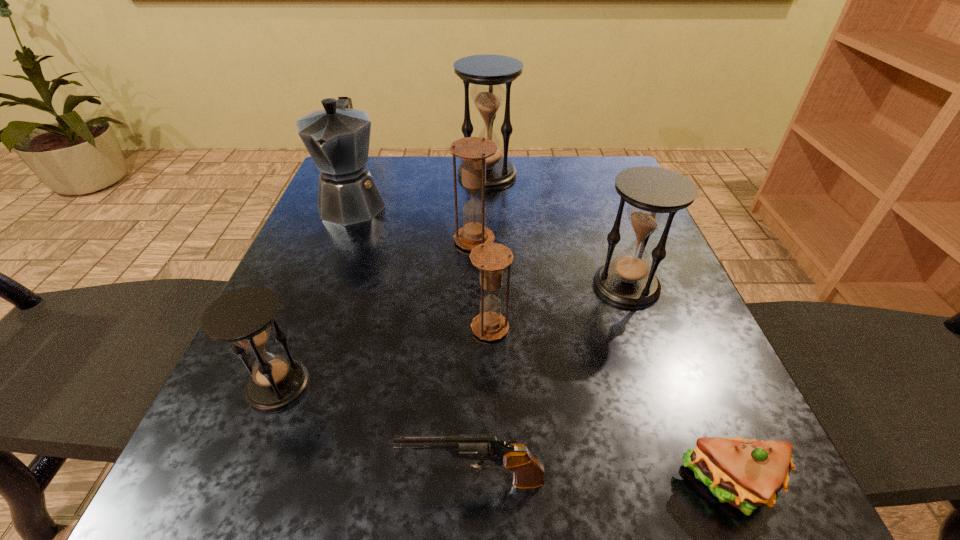
This screenshot has width=960, height=540. Find the location of `the nearest hourglass`. the nearest hourglass is located at coordinates (243, 316).

Find the location of `gun`. gun is located at coordinates (528, 473).

Find the location of a particular element. This screenshot has height=540, width=960. sandwich is located at coordinates (745, 473).

Find the location of a particular element. Image resolution: width=960 pixels, height=540 pixels. free space located 0.290m on the left of the second black hourglass from left to right is located at coordinates (346, 174).

The width and height of the screenshot is (960, 540). Find the location of `free space located 0.060m at the spout of the coffeepot`. free space located 0.060m at the spout of the coffeepot is located at coordinates (335, 248).

What are the coordinates of `free space located on the right of the farther brown hourglass` in the screenshot? It's located at (589, 240).

This screenshot has width=960, height=540. What are the coordinates of `vacant space situated 0.150m on the front of the third farthest hourglass` in the screenshot? It's located at (660, 380).

This screenshot has height=540, width=960. What are the coordinates of `vacant area situated 0.180m on the front of the fourth nearest object` in the screenshot? It's located at (492, 447).

The image size is (960, 540). Identify the location of free space located on the right of the nearest black hourglass. (566, 386).

Locate an element on the screen. The image size is (960, 540). blank space located along the barrel of the black gun is located at coordinates (277, 481).